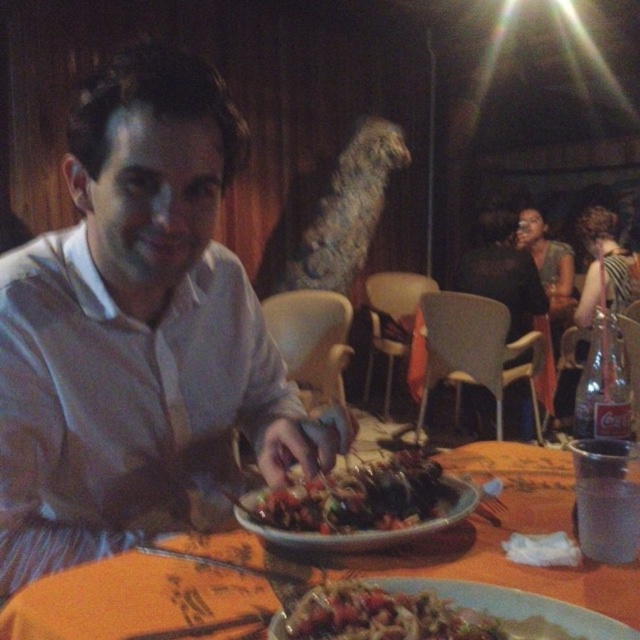
Question: Does slightly charred skewers at center appear over matte ceramic plate at center?

Choices:
 (A) yes
 (B) no

Answer: (A)

Question: Which object appears closest to the camera in this image?

Choices:
 (A) orange fabric table at center
 (B) matte ceramic plate at center
 (C) matte white shirt at center

Answer: (B)

Question: Is matte white shirt at center bigger than orange fabric table at center?

Choices:
 (A) yes
 (B) no

Answer: (A)

Question: Estimate the real-world distances between objects in this image. Which object is closer to the matte white shirt at center?

Choices:
 (A) orange fabric table at center
 (B) slightly charred skewers at center

Answer: (A)

Question: Considering the relative positions of orange fabric table at center and matte ceramic plate at center in the image provided, where is orange fabric table at center located with respect to matte ceramic plate at center?

Choices:
 (A) below
 (B) above

Answer: (A)

Question: Estimate the real-world distances between objects in this image. Which object is closer to the slightly charred skewers at center?

Choices:
 (A) orange fabric table at center
 (B) matte ceramic plate at center

Answer: (A)